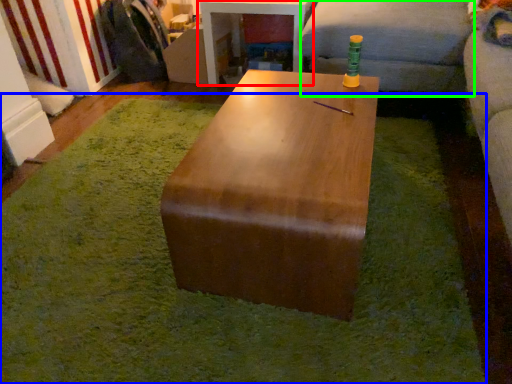
Question: Based on their relative distances, which object is nearer to table (highlighted by a red box)? Choose from mat (highlighted by a blue box) and couch (highlighted by a green box).

Choices:
 (A) mat
 (B) couch

Answer: (B)